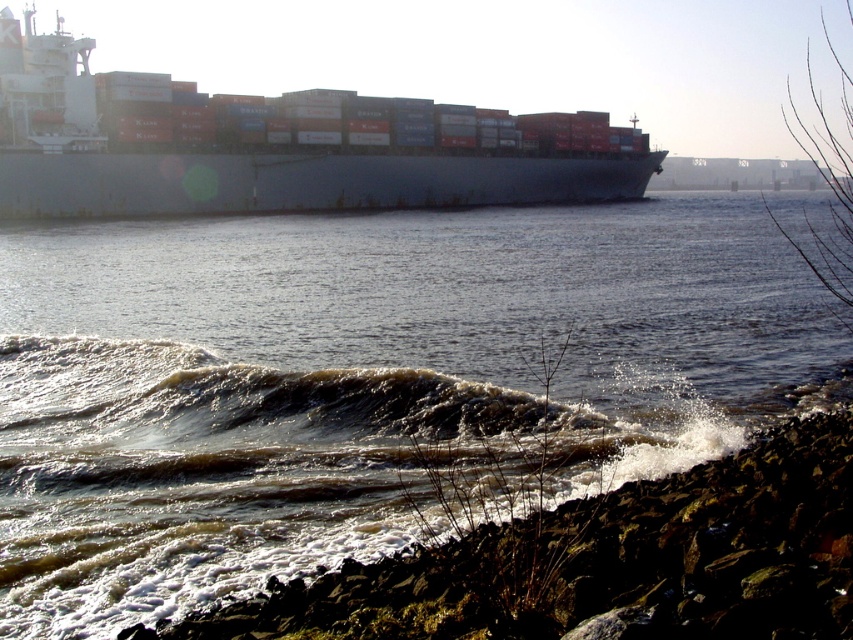
Is brown/foamy water at center below metallic gray ship at upper left?

Correct, brown/foamy water at center is located below metallic gray ship at upper left.

Between brown/foamy water at center and metallic gray ship at upper left, which one appears on the right side from the viewer's perspective?

From the viewer's perspective, brown/foamy water at center appears more on the right side.

Identify the location of brown/foamy water at center. (355, 380).